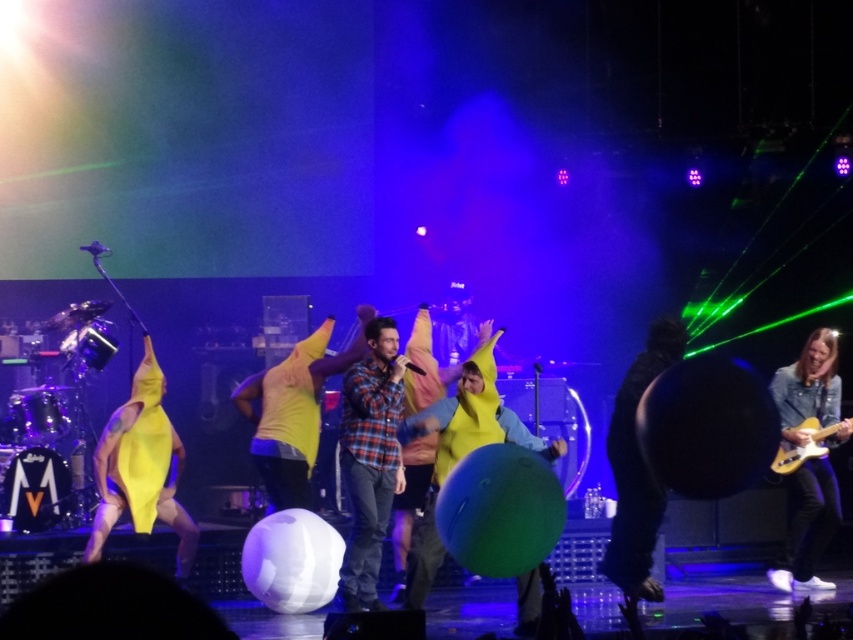
You are a stagehand setting up for a concert. You see two bananas, the yellow rubber banana at center and the yellow matte banana at center. Which banana is placed below the other?

The yellow rubber banana at center is positioned under the yellow matte banana at center.

You are a photographer at the concert and want to take a photo that includes both the yellow rubber banana at center and the denim jacket at lower right. Which object will appear larger in the photo?

The yellow rubber banana at center will appear larger in the photo because it is closer to the viewer than the denim jacket at lower right.